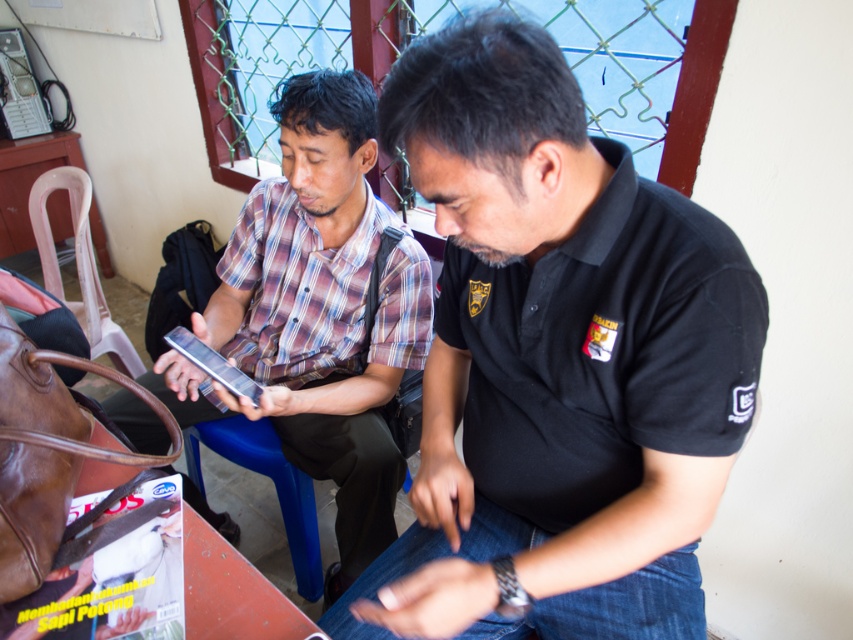
Question: Which object is positioned farthest from the black matte shirt at center?

Choices:
 (A) plaid shirt at center
 (B) metallic silver phone at center

Answer: (B)

Question: Can you confirm if black matte shirt at center is positioned above metallic silver phone at center?

Choices:
 (A) no
 (B) yes

Answer: (A)

Question: Does black matte shirt at center have a lesser width compared to plaid shirt at center?

Choices:
 (A) no
 (B) yes

Answer: (B)

Question: Which object appears farthest from the camera in this image?

Choices:
 (A) metallic silver phone at center
 (B) plaid shirt at center

Answer: (B)

Question: Is plaid shirt at center below metallic silver phone at center?

Choices:
 (A) no
 (B) yes

Answer: (B)

Question: Which point is closer to the camera taking this photo?

Choices:
 (A) (259, 301)
 (B) (410, 611)

Answer: (B)